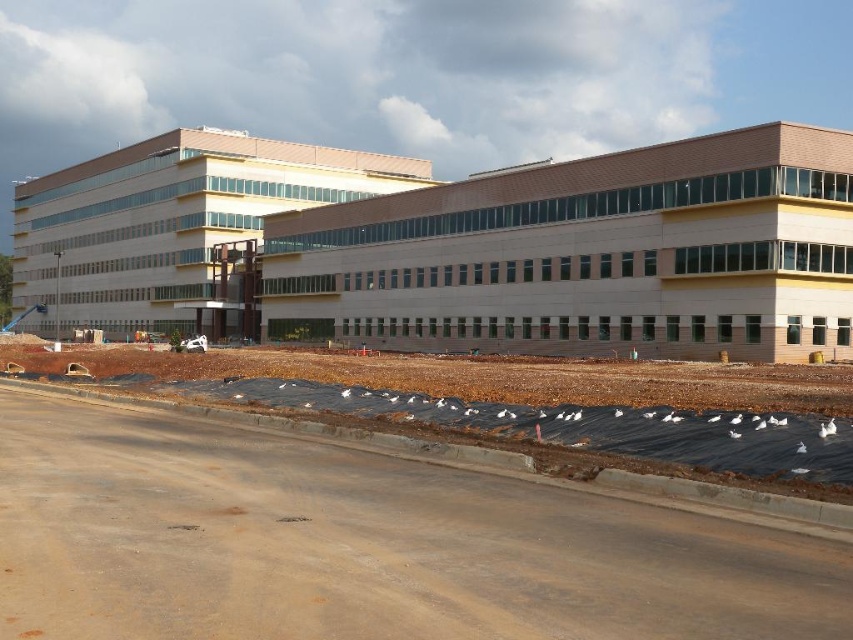
Question: Considering the real-world distances, which object is farthest from the beige concrete building at center?

Choices:
 (A) matte beige building at center
 (B) brown dirt at lower center

Answer: (B)

Question: Considering the relative positions of brown dirt at lower center and beige concrete building at center in the image provided, where is brown dirt at lower center located with respect to beige concrete building at center?

Choices:
 (A) right
 (B) left

Answer: (B)

Question: Which point appears farthest from the camera in this image?

Choices:
 (A) (115, 602)
 (B) (573, 161)

Answer: (B)

Question: Does brown dirt at lower center have a smaller size compared to beige concrete building at center?

Choices:
 (A) no
 (B) yes

Answer: (B)

Question: Which of these objects is positioned farthest from the matte beige building at center?

Choices:
 (A) beige concrete building at center
 (B) brown dirt at lower center

Answer: (B)

Question: Can you confirm if brown dirt at lower center is positioned to the left of beige concrete building at center?

Choices:
 (A) no
 (B) yes

Answer: (B)